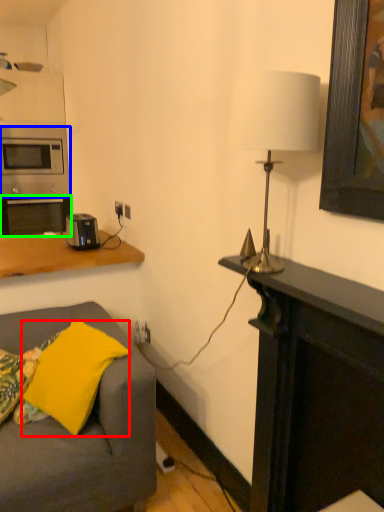
Question: Which is nearer to the pillow (highlighted by a red box)? microwave oven (highlighted by a blue box) or oven (highlighted by a green box).

Choices:
 (A) microwave oven
 (B) oven

Answer: (B)